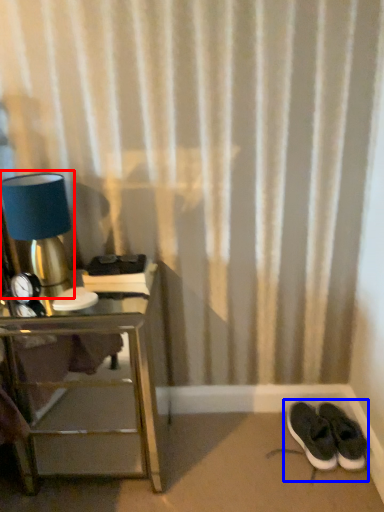
Question: Which point is closer to the camera, table lamp (highlighted by a red box) or footwear (highlighted by a blue box)?

Choices:
 (A) table lamp
 (B) footwear

Answer: (A)